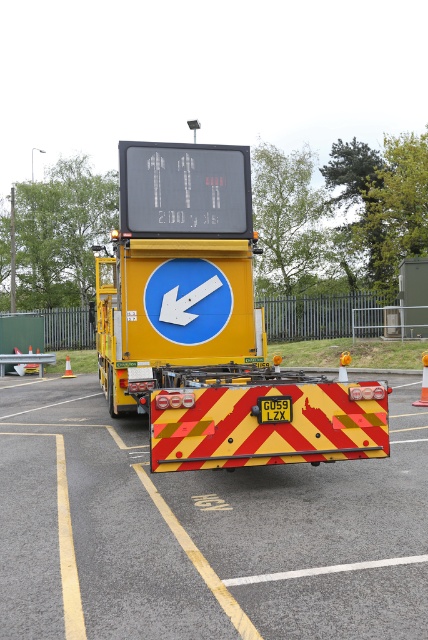
You are a driver approaching the rear of the mobile gantry sign vehicle and see the orange plastic traffic cone at left and the orange plastic traffic cone at lower left. Which traffic cone takes up more space in the image?

→ The orange plastic traffic cone at lower left takes up more space in the image than the orange plastic traffic cone at left.

You are a driver approaching the rear of the road maintenance vehicle and see the orange plastic traffic cone at left and the orange plastic traffic cone at lower left. Which traffic cone is closer to you?

The orange plastic traffic cone at left is closer to you because it is further to the viewer than the orange plastic traffic cone at lower left, meaning it is positioned nearer in the scene.